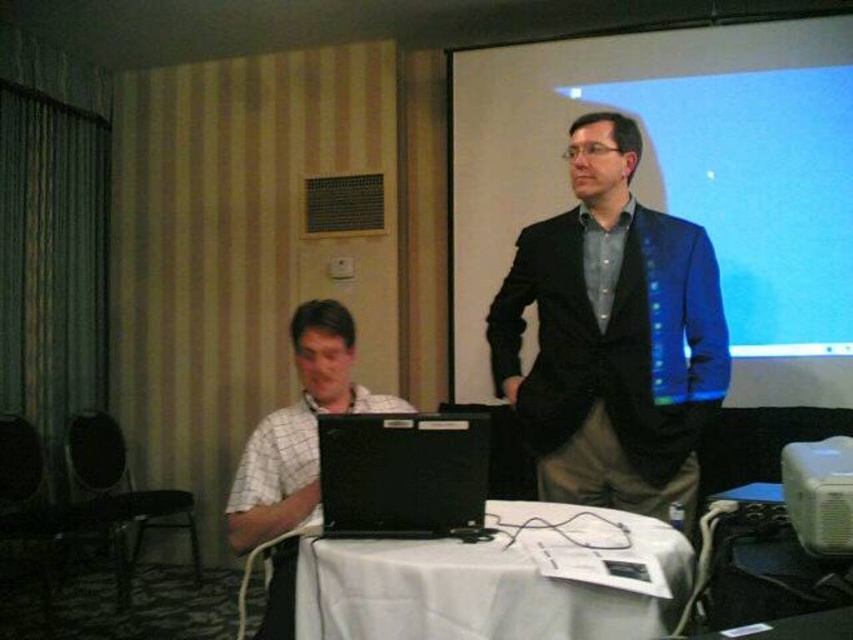
Question: Is the position of matte black blazer at center less distant than that of white checkered shirt at left?

Choices:
 (A) yes
 (B) no

Answer: (B)

Question: Does matte black blazer at center appear over white cloth-covered table at center?

Choices:
 (A) no
 (B) yes

Answer: (B)

Question: Which is farther from the white plastic projector at lower right?

Choices:
 (A) matte black blazer at center
 (B) white checkered shirt at left
 (C) black matte laptop at center

Answer: (B)

Question: Among these points, which one is farthest from the camera?

Choices:
 (A) (827, 440)
 (B) (500, 134)
 (C) (410, 452)
 (D) (457, 560)

Answer: (B)

Question: Considering the relative positions of blue glossy projection screen at upper right and white plastic projector at lower right in the image provided, where is blue glossy projection screen at upper right located with respect to white plastic projector at lower right?

Choices:
 (A) right
 (B) left

Answer: (A)

Question: Among these points, which one is farthest from the camera?

Choices:
 (A) click(286, 552)
 (B) click(648, 536)

Answer: (A)